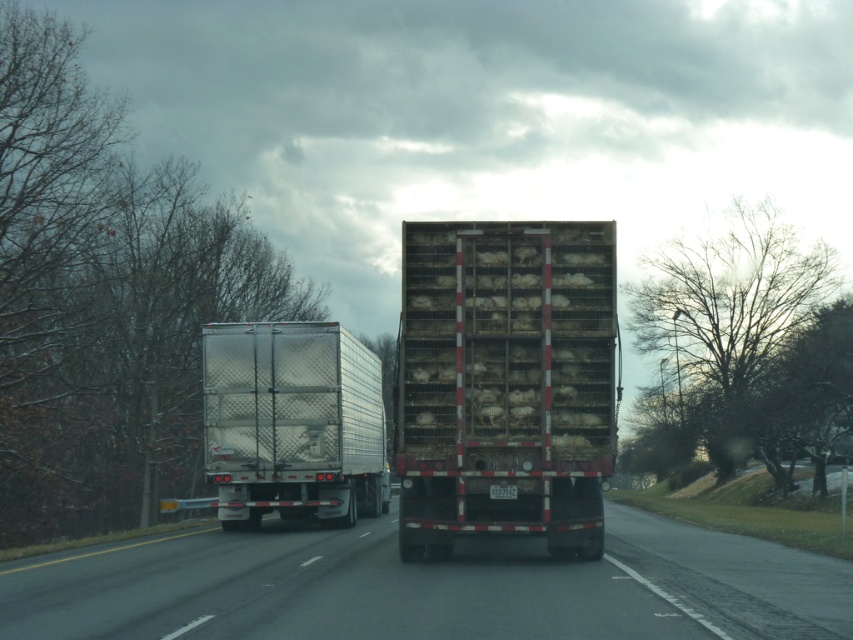
Does black rubber highway at center have a greater width compared to silver metallic trailer truck at center?

Yes.

Which is behind, point (628, 529) or point (352, 404)?

The point (352, 404) is behind.

Is point (19, 604) positioned behind point (279, 332)?

No, it is not.

Where is `black rubber highway at center`? The height and width of the screenshot is (640, 853). black rubber highway at center is located at coordinates (427, 586).

Who is taller, black rubber highway at center or metallic mesh trailer truck at center?

metallic mesh trailer truck at center

Who is higher up, black rubber highway at center or metallic mesh trailer truck at center?

metallic mesh trailer truck at center is above.

Is point (299, 604) closer to viewer compared to point (601, 387)?

That is True.

At what (x,y) coordinates should I click in order to perform the action: click on black rubber highway at center. Please return your answer as a coordinate pair (x, y). The height and width of the screenshot is (640, 853). Looking at the image, I should click on (427, 586).

Between point (526, 500) and point (309, 458), which one is positioned in front?

Point (526, 500) is more forward.

Between metallic mesh trailer truck at center and silver metallic trailer truck at center, which one appears on the right side from the viewer's perspective?

metallic mesh trailer truck at center is more to the right.

Based on the photo, who is more distant from viewer, (444, 413) or (315, 492)?

The point (315, 492) is behind.

Identify the location of metallic mesh trailer truck at center. This screenshot has width=853, height=640. (505, 384).